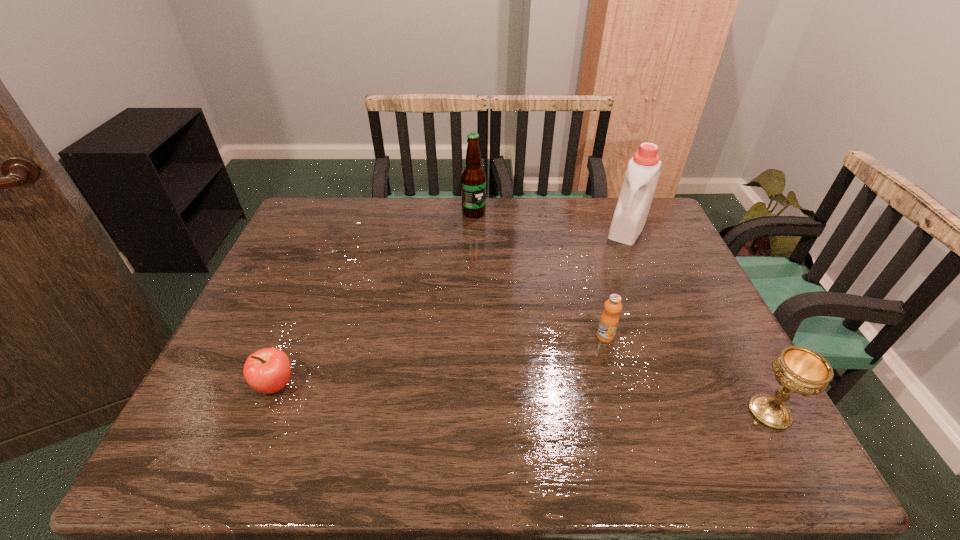
Locate an element on the screen. The height and width of the screenshot is (540, 960). free spot between the leftmost object and the detergent is located at coordinates 451,307.

Image resolution: width=960 pixels, height=540 pixels. I want to click on unoccupied position between the beer bottle and the fourth object from left to right, so click(551, 220).

Where is `vacant point located between the chalice and the orange juice`? The image size is (960, 540). vacant point located between the chalice and the orange juice is located at coordinates (687, 375).

At what (x,y) coordinates should I click in order to perform the action: click on empty space between the shortest object and the beer bottle. Please return your answer as a coordinate pair (x, y). The image size is (960, 540). Looking at the image, I should click on (374, 299).

Identify which object is located as the third nearest to the third nearest object. Please provide its 2D coordinates. Your answer should be formatted as a tuple, i.e. [(x, y)], where the tuple contains the x and y coordinates of a point satisfying the conditions above.

[(473, 177)]

Locate which object is the fourth closest to the second shortest object. Please provide its 2D coordinates. Your answer should be formatted as a tuple, i.e. [(x, y)], where the tuple contains the x and y coordinates of a point satisfying the conditions above.

[(268, 370)]

This screenshot has height=540, width=960. Identify the location of vacant space that satisfies the following two spatial constraints: 1. on the front side of the detergent; 2. on the left side of the fourth object from right to left. (473, 228).

Find the location of a particular element. vacant point that satisfies the following two spatial constraints: 1. on the front side of the rightmost object; 2. on the left side of the orange juice is located at coordinates (626, 413).

Find the location of a particular element. The height and width of the screenshot is (540, 960). vacant point that satisfies the following two spatial constraints: 1. on the front side of the second shortest object; 2. on the right side of the beer bottle is located at coordinates (471, 336).